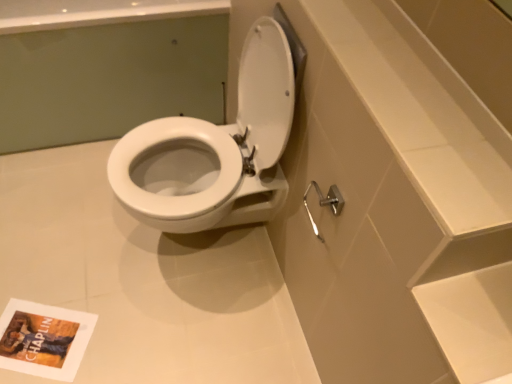
What are the coordinates of `free space to the back side of matte paper book cover at lower left` in the screenshot? It's located at (61, 274).